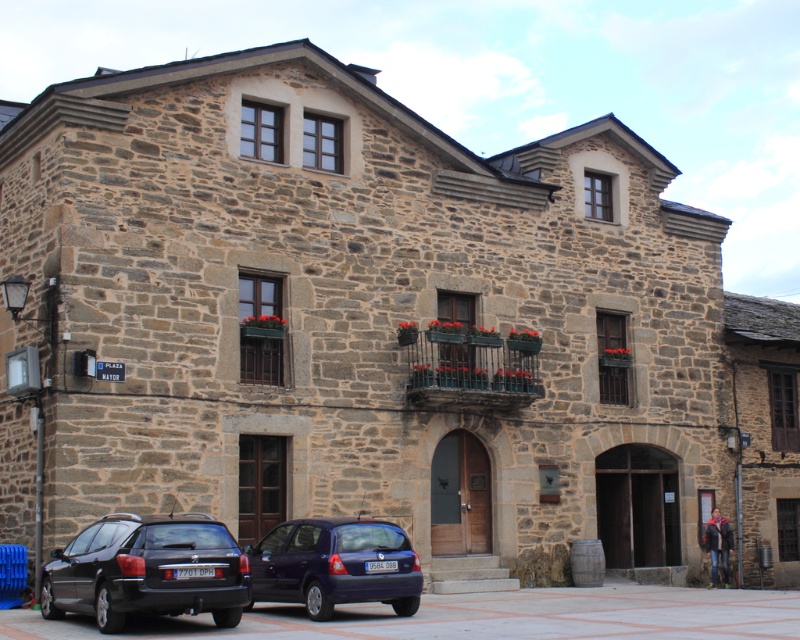
Can you confirm if shiny black station wagon at lower left is taller than metallic blue hatchback at center?

Incorrect, shiny black station wagon at lower left's height is not larger of metallic blue hatchback at center's.

Is shiny black station wagon at lower left closer to the viewer compared to metallic blue hatchback at center?

Yes, shiny black station wagon at lower left is in front of metallic blue hatchback at center.

This screenshot has height=640, width=800. What are the coordinates of `shiny black station wagon at lower left` in the screenshot? It's located at (148, 570).